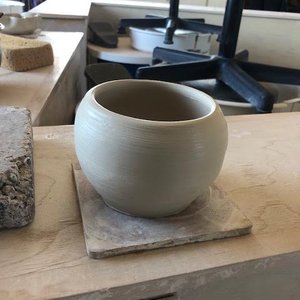
Image resolution: width=300 pixels, height=300 pixels. I want to click on tabletop, so click(x=43, y=98).